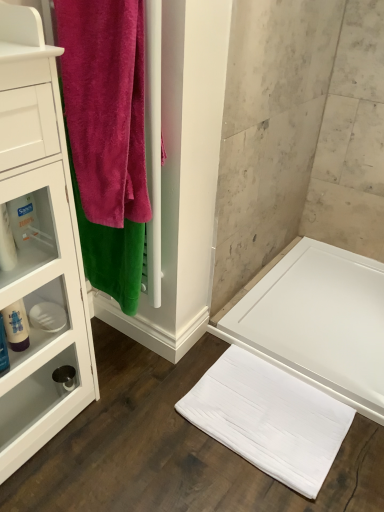
Where is `vacant area that lies between white glossy cabinet at left and white soft towel at lower center`? The width and height of the screenshot is (384, 512). vacant area that lies between white glossy cabinet at left and white soft towel at lower center is located at coordinates (145, 434).